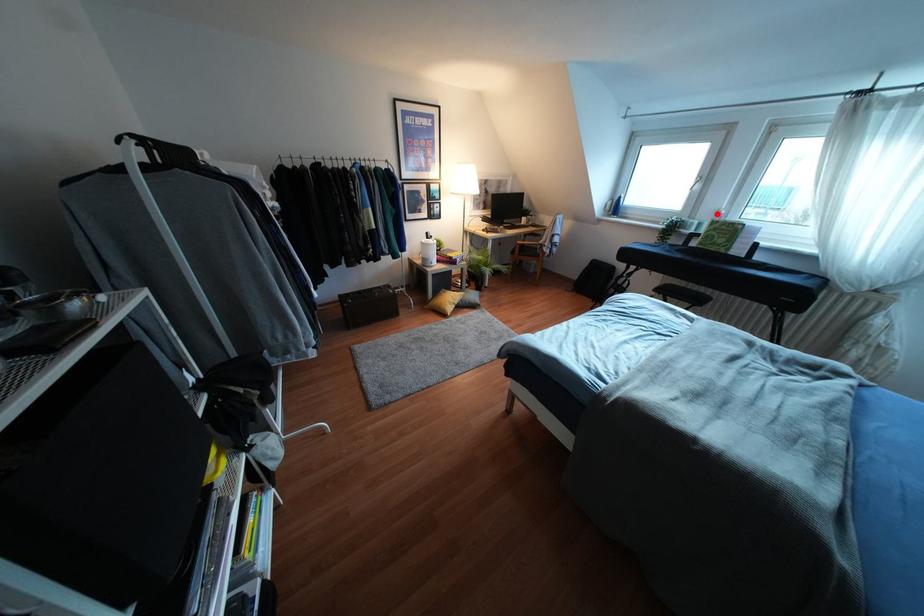
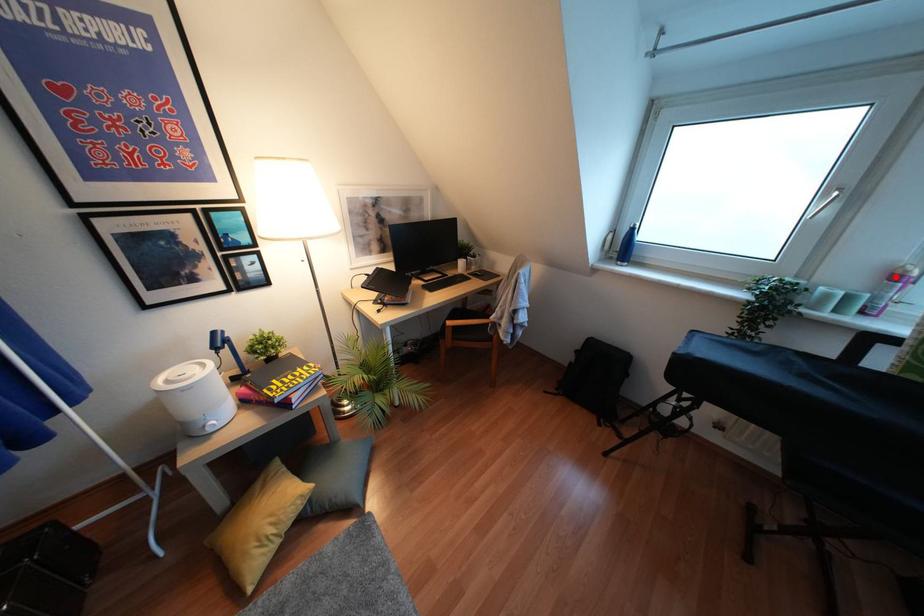
I am providing you with two images of the same scene from different viewpoints. A red point is marked on the first image and another point is marked on the second image. Does the point marked in image1 correspond to the same location as the one in image2?

Yes